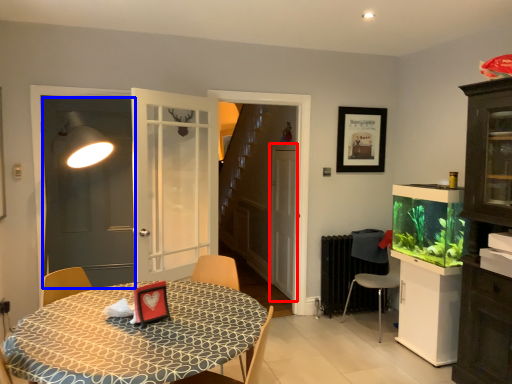
Question: Among these objects, which one is farthest to the camera, screen door (highlighted by a red box) or screen door (highlighted by a blue box)?

Choices:
 (A) screen door
 (B) screen door

Answer: (A)